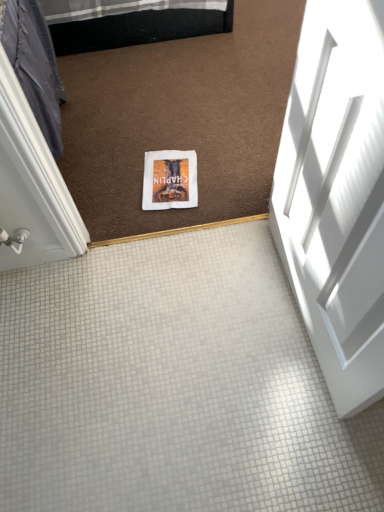
Find the location of a particular element. The image size is (384, 512). vacant region above white paper at center (from a real-world perspective) is located at coordinates (169, 178).